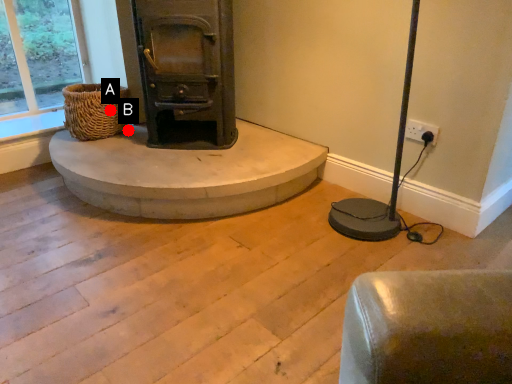
Question: Two points are circled on the image, labeled by A and B beside each circle. Which point is closer to the camera taking this photo?

Choices:
 (A) A is closer
 (B) B is closer

Answer: (A)